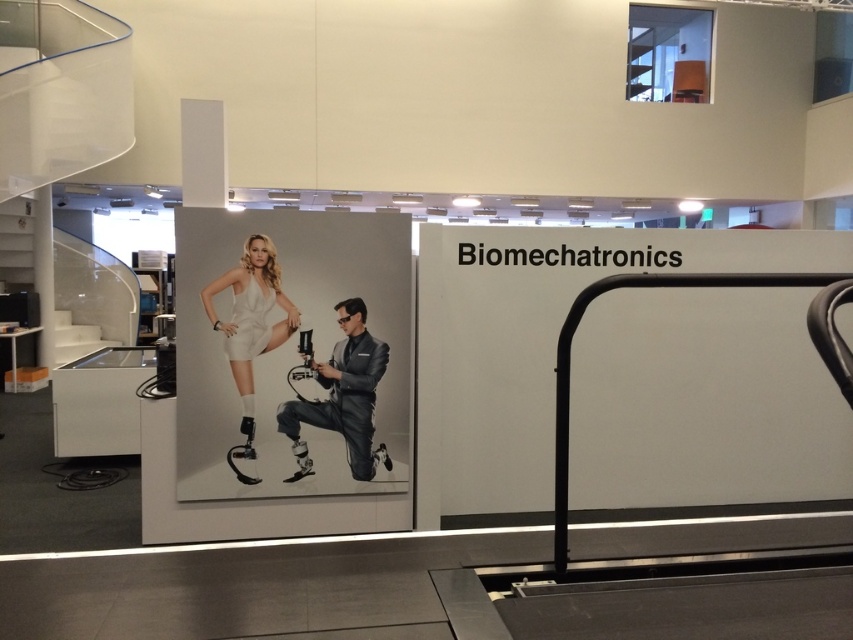
Between point (839, 376) and point (57, 323), which one is positioned behind?

The point (57, 323) is behind.

Which is in front, point (846, 285) or point (96, 330)?

Point (846, 285) is in front.

At what (x,y) coordinates should I click in order to perform the action: click on black metal rail at right. Please return your answer as a coordinate pair (x, y). The width and height of the screenshot is (853, 640). Looking at the image, I should click on (694, 285).

Does point (370, 440) come closer to viewer compared to point (276, 284)?

No, (370, 440) is behind (276, 284).

Who is shorter, shiny metallic suit at center or white matte dress at center?

Standing shorter between the two is shiny metallic suit at center.

Locate an element on the screen. Image resolution: width=853 pixels, height=640 pixels. shiny metallic suit at center is located at coordinates (343, 394).

Find the location of a particular element. This screenshot has width=853, height=640. shiny metallic suit at center is located at coordinates (343, 394).

Does point (354, 381) come farther from viewer compared to point (105, 339)?

No, it is not.

Does shiny metallic suit at center have a larger size compared to white glossy stair at left?

No.

Is point (288, 401) positioned after point (64, 355)?

No.

Where is `shiny metallic suit at center`? Image resolution: width=853 pixels, height=640 pixels. shiny metallic suit at center is located at coordinates [x=343, y=394].